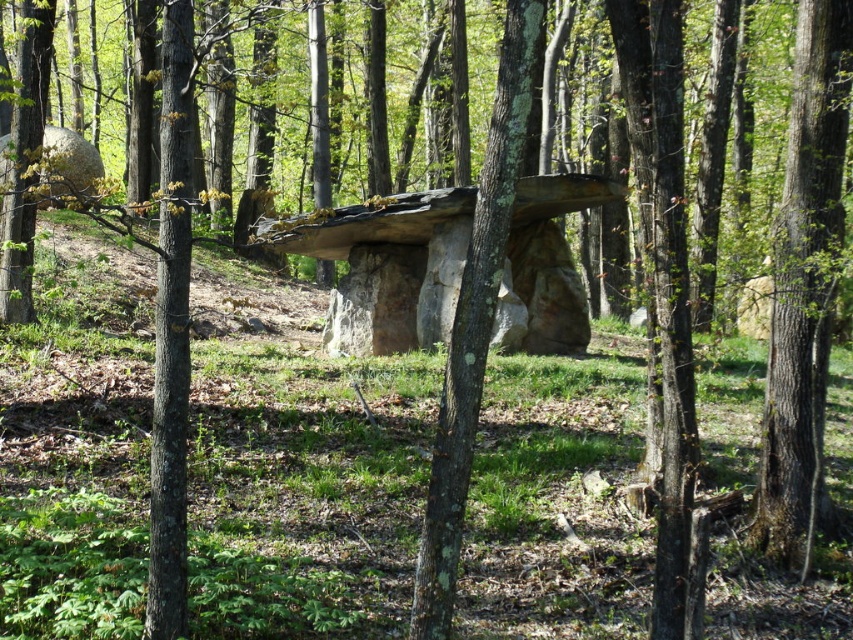
Is point (844, 80) farther from viewer compared to point (460, 538)?

Yes, it is.

Is smooth bark tree at center shorter than lichen-covered tree trunk at center?

Incorrect, smooth bark tree at center's height does not fall short of lichen-covered tree trunk at center's.

Is point (815, 35) more distant than point (471, 449)?

Yes, it is.

At what (x,y) coordinates should I click in order to perform the action: click on smooth bark tree at center. Please return your answer as a coordinate pair (x, y). The height and width of the screenshot is (640, 853). Looking at the image, I should click on (804, 284).